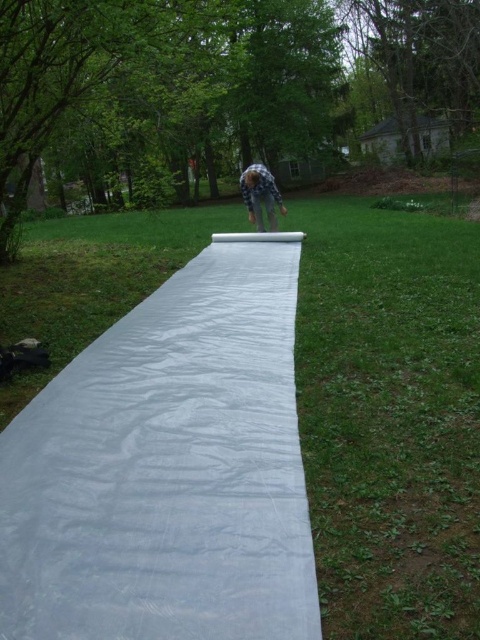
Is transparent plastic sheet at center to the right of blue plaid shirt at center from the viewer's perspective?

In fact, transparent plastic sheet at center is to the left of blue plaid shirt at center.

Does transparent plastic sheet at center come behind blue plaid shirt at center?

No, it is in front of blue plaid shirt at center.

Is point (60, 492) less distant than point (252, 220)?

That is True.

Locate an element on the screen. This screenshot has height=640, width=480. transparent plastic sheet at center is located at coordinates (168, 468).